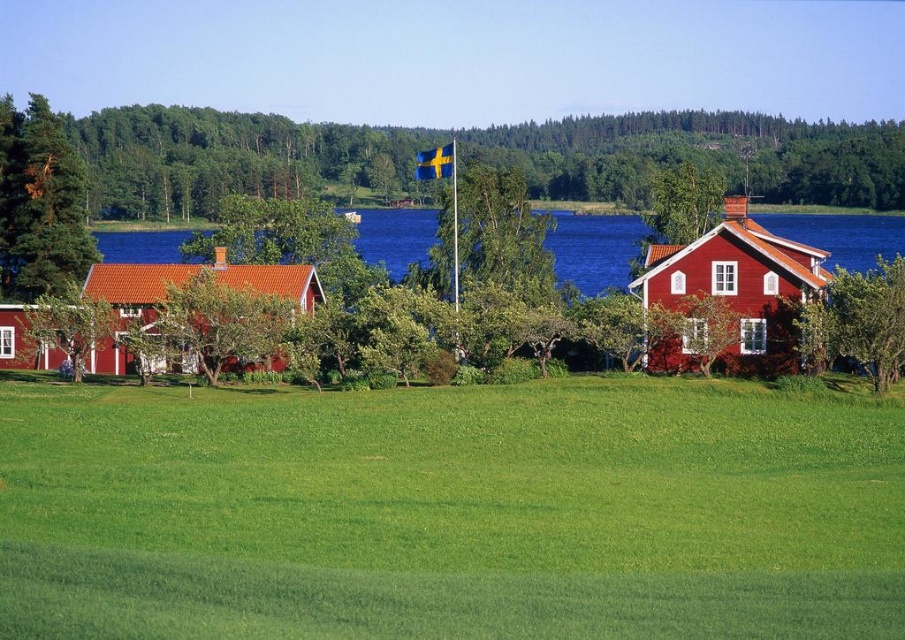
You are standing at the edge of the green leafy tree at upper left and want to walk towards the green grassy field at lower center. In which direction should you head?

You should head to the right to reach the green grassy field at lower center since it is located to the right of the green leafy tree at upper left.

You are a landscape architect designing a garden path between the green leafy tree at upper left and the green pine tree at left. Which tree will you need to consider for clearance due to its size?

The green leafy tree at upper left is larger in size than the green pine tree at left, so you should consider the green leafy tree at upper left for clearance when designing the garden path.

You are planning to plant a new tree in the rural landscape between the two red houses. You have two options to choose from the image. Which tree, the green leafy tree at upper left or the green pine tree at left, would you place closer to the houses to ensure it doesn

The green pine tree at left should be placed closer to the houses because it is currently positioned behind the green leafy tree at upper left, meaning it is farther away from the houses. To bring it closer, you would move it in front of the green leafy tree at upper left.